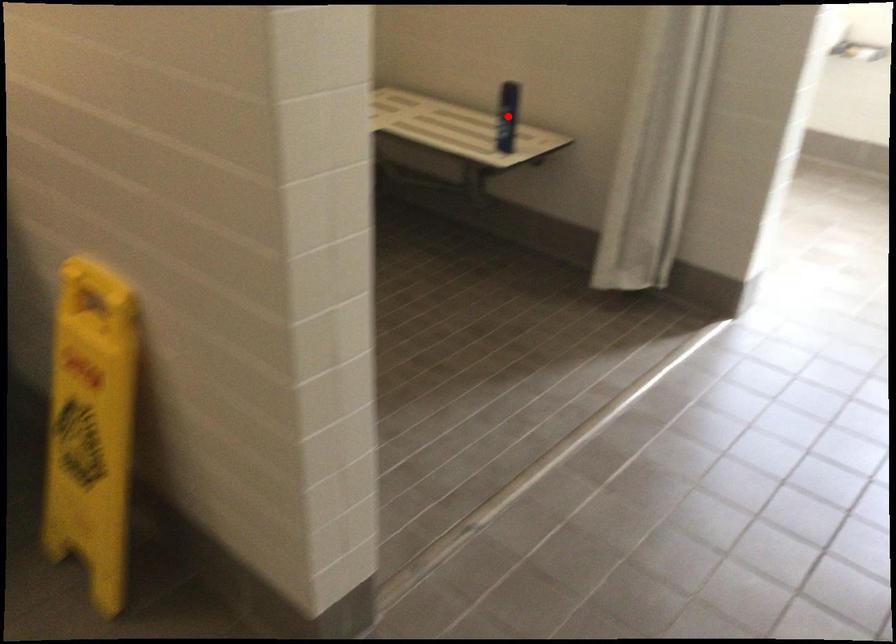
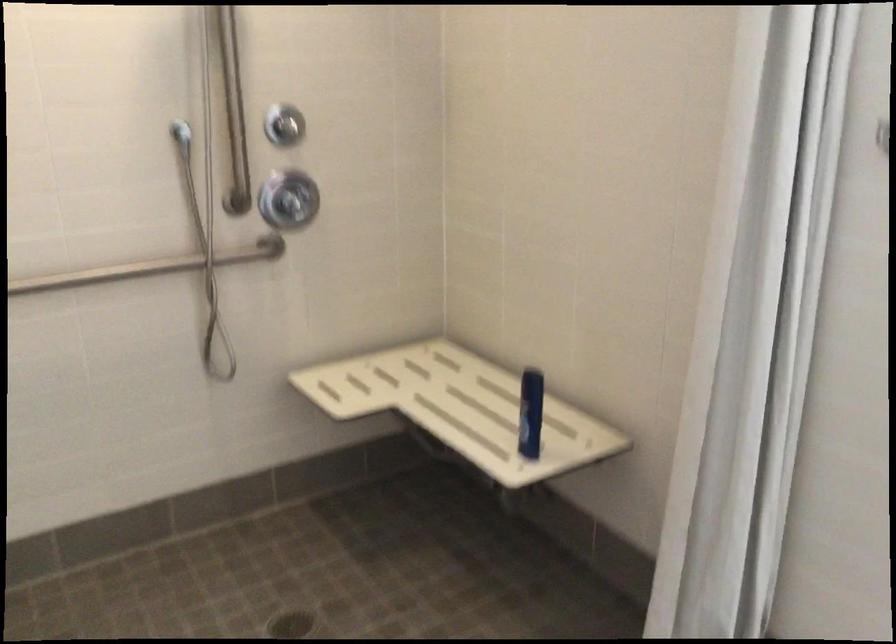
Question: I am providing you with two images of the same scene from different viewpoints. Image1 has a red point marked. In image2, the corresponding 3D location appears at what relative position? Reply with the corresponding letter.

Choices:
 (A) Closer
 (B) Farther

Answer: (A)